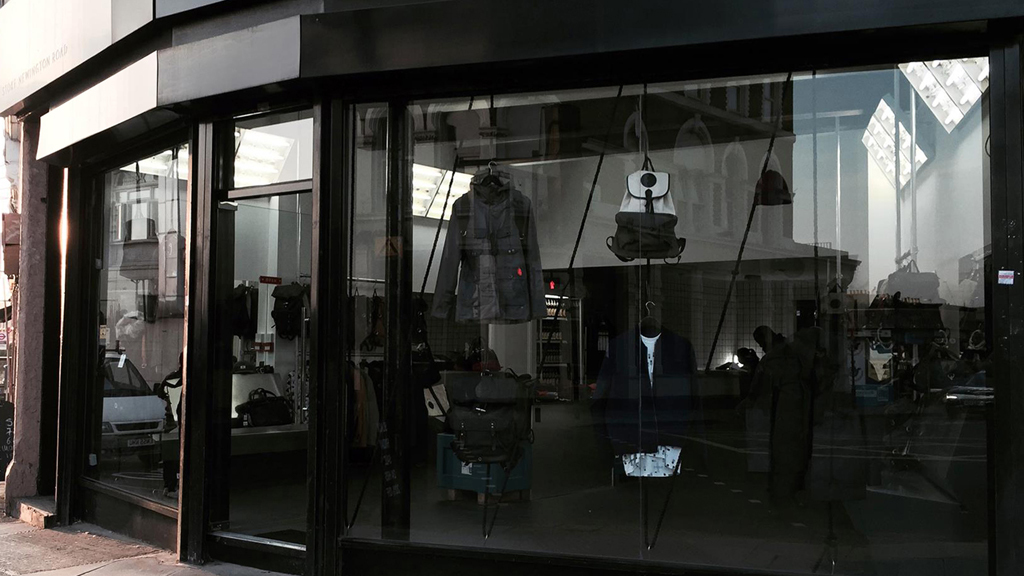
The width and height of the screenshot is (1024, 576). Identify the location of lights. (864, 131).